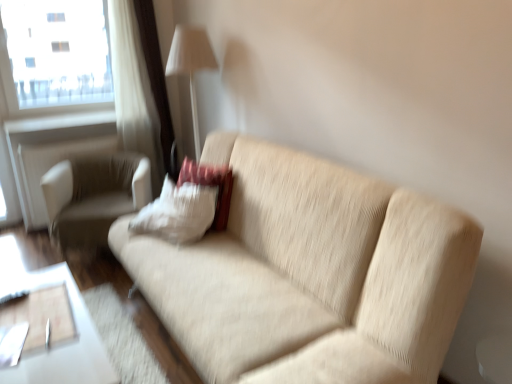
Question: Is white fabric chair at left shorter than white fabric window frame at upper left?

Choices:
 (A) yes
 (B) no

Answer: (A)

Question: Is white fabric chair at left oriented away from white fabric window frame at upper left?

Choices:
 (A) yes
 (B) no

Answer: (B)

Question: From a real-world perspective, is white fabric chair at left over white fabric window frame at upper left?

Choices:
 (A) yes
 (B) no

Answer: (B)

Question: Can you confirm if white fabric chair at left is wider than white fabric window frame at upper left?

Choices:
 (A) no
 (B) yes

Answer: (B)

Question: Is white fabric chair at left to the right of white fabric window frame at upper left from the viewer's perspective?

Choices:
 (A) yes
 (B) no

Answer: (A)

Question: Can we say white fabric chair at left lies outside white fabric window frame at upper left?

Choices:
 (A) yes
 (B) no

Answer: (A)

Question: Considering the relative sizes of white matte radiator at upper left and white glossy table at lower left in the image provided, is white matte radiator at upper left shorter than white glossy table at lower left?

Choices:
 (A) yes
 (B) no

Answer: (A)

Question: Is white matte radiator at upper left wider than white glossy table at lower left?

Choices:
 (A) no
 (B) yes

Answer: (A)

Question: Is white matte radiator at upper left further to the viewer compared to white glossy table at lower left?

Choices:
 (A) no
 (B) yes

Answer: (B)

Question: Considering the relative sizes of white matte radiator at upper left and white glossy table at lower left in the image provided, is white matte radiator at upper left thinner than white glossy table at lower left?

Choices:
 (A) no
 (B) yes

Answer: (B)

Question: From a real-world perspective, is white matte radiator at upper left on top of white glossy table at lower left?

Choices:
 (A) yes
 (B) no

Answer: (A)

Question: Does white matte radiator at upper left appear on the right side of white glossy table at lower left?

Choices:
 (A) yes
 (B) no

Answer: (B)

Question: Does transparent glass window at upper left appear on the left side of white fabric lampshade at upper center?

Choices:
 (A) no
 (B) yes

Answer: (B)